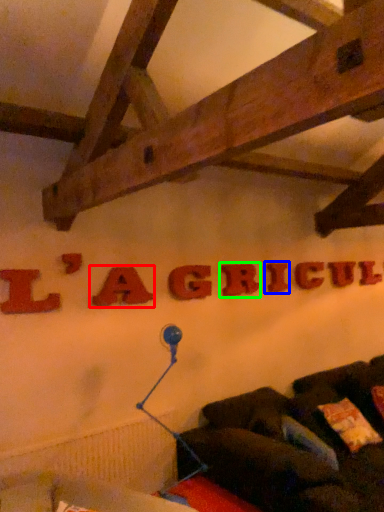
Question: Which object is positioned closest to letter (highlighted by a red box)? Select from letter (highlighted by a blue box) and letter (highlighted by a green box).

Choices:
 (A) letter
 (B) letter

Answer: (B)